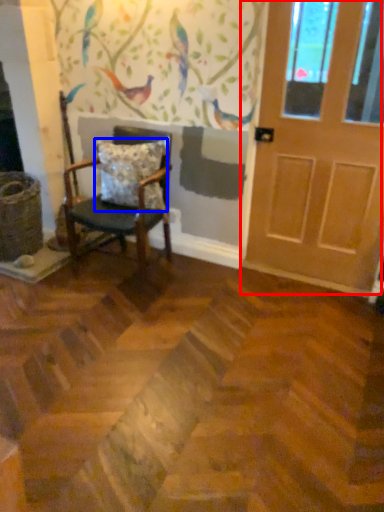
Question: Among these objects, which one is nearest to the camera, door (highlighted by a red box) or pillow (highlighted by a blue box)?

Choices:
 (A) door
 (B) pillow

Answer: (A)